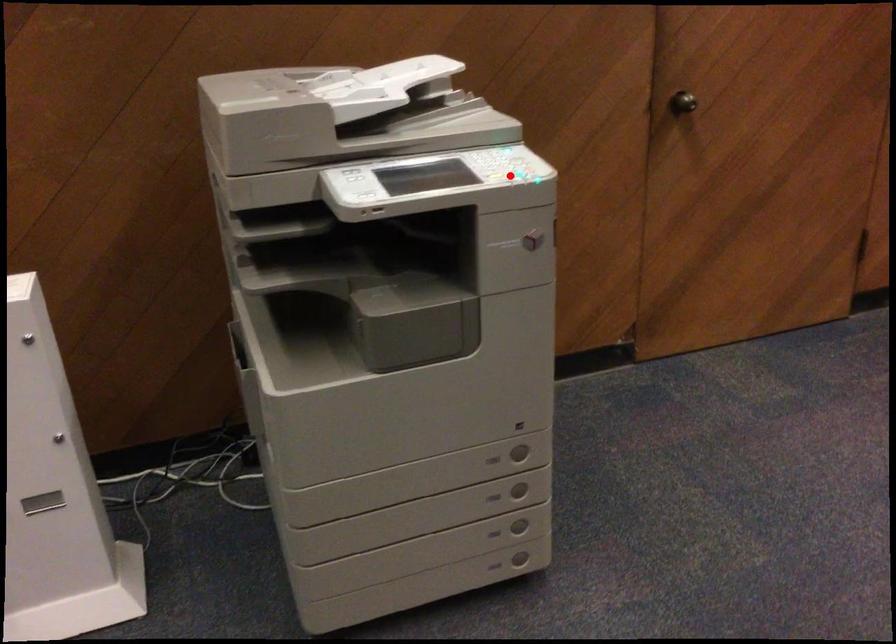
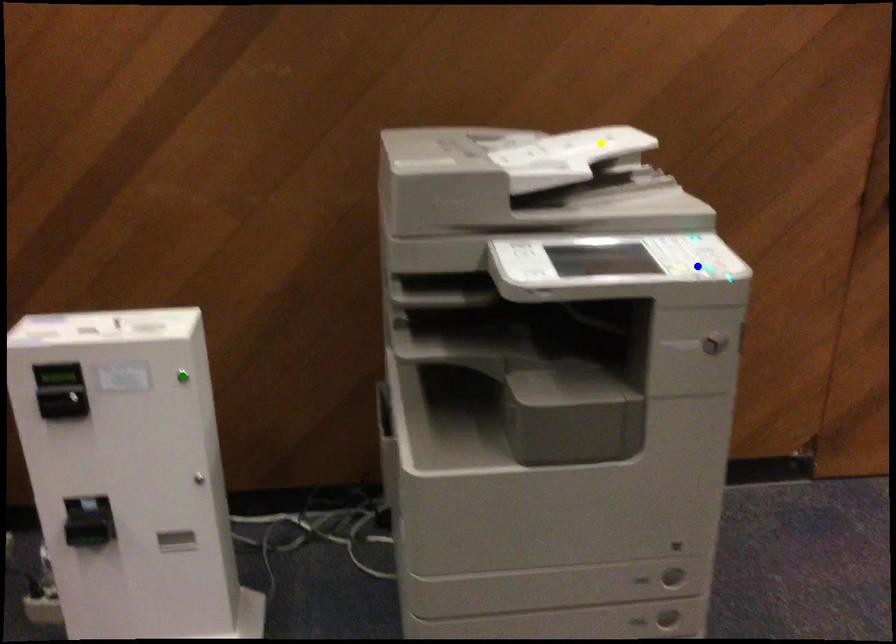
Question: I am providing you with two images of the same scene from different viewpoints. A red point is marked on the first image. You are given multiple points on the second image. Which point in image 2 is actually the same real-world point as the red point in image 1?

Choices:
 (A) yellow point
 (B) blue point
 (C) green point

Answer: (B)